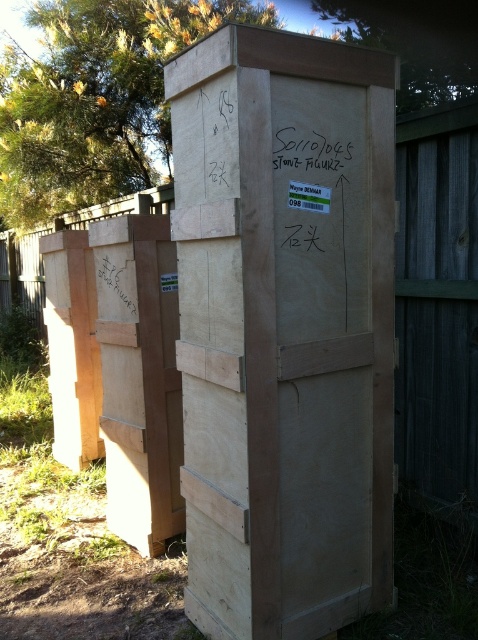
Where is `natural wood cardboard box at center`? natural wood cardboard box at center is located at coordinates (284, 328).

Describe the element at coordinates (284, 328) in the screenshot. This screenshot has height=640, width=478. I see `natural wood cardboard box at center` at that location.

This screenshot has height=640, width=478. Find the location of `natural wood cardboard box at center`. natural wood cardboard box at center is located at coordinates (284, 328).